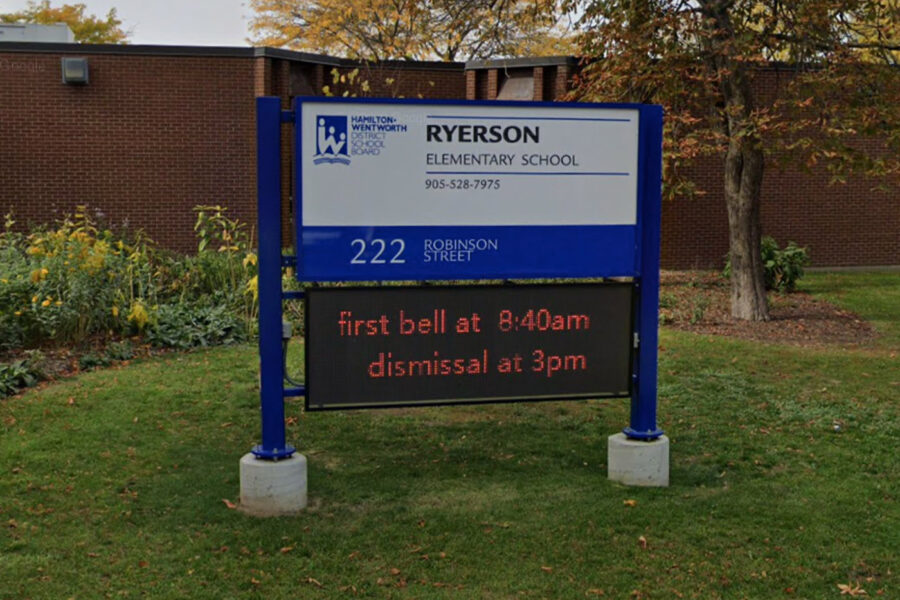
At what (x,y) coordinates should I click in order to perform the action: click on wall. Please return your answer as a coordinate pair (x, y). This screenshot has width=900, height=600. Looking at the image, I should click on (184, 118).